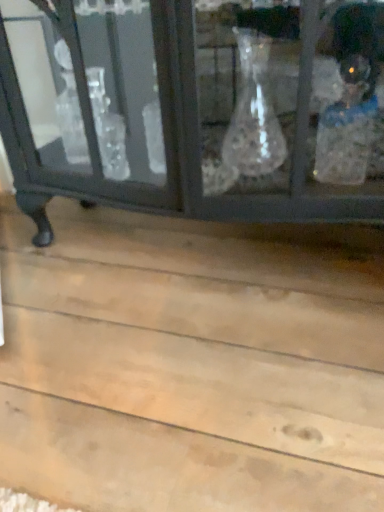
Where is `vacant space underneath matte black cabinet at upper center (from a real-world perspective)`? vacant space underneath matte black cabinet at upper center (from a real-world perspective) is located at coordinates (205, 247).